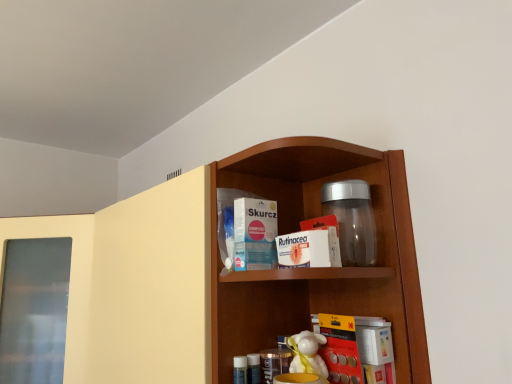
Question: In the image, is white paper packet at center, acting as the 1th product starting from the left, positioned in front of or behind yellow matte book at lower center?

Choices:
 (A) behind
 (B) front

Answer: (A)

Question: From their relative heights in the image, would you say white paper packet at center, acting as the 1th product starting from the left, is taller or shorter than yellow matte book at lower center?

Choices:
 (A) short
 (B) tall

Answer: (A)

Question: Estimate the real-world distances between objects in this image. Which object is farther from the white paper packet at center, which is the second product from right to left?

Choices:
 (A) transparent plastic jar at upper center
 (B) white cardboard box at center, the 2th product positioned from the left
 (C) yellow matte book at lower center
 (D) wooden shelf at center
 (E) white glossy toy at center

Answer: (D)

Question: Based on their relative distances, which object is nearer to the wooden shelf at center?

Choices:
 (A) white glossy toy at center
 (B) white paper packet at center, acting as the 1th product starting from the left
 (C) white cardboard box at center, the 2th product positioned from the left
 (D) yellow matte book at lower center
 (E) transparent plastic jar at upper center

Answer: (B)